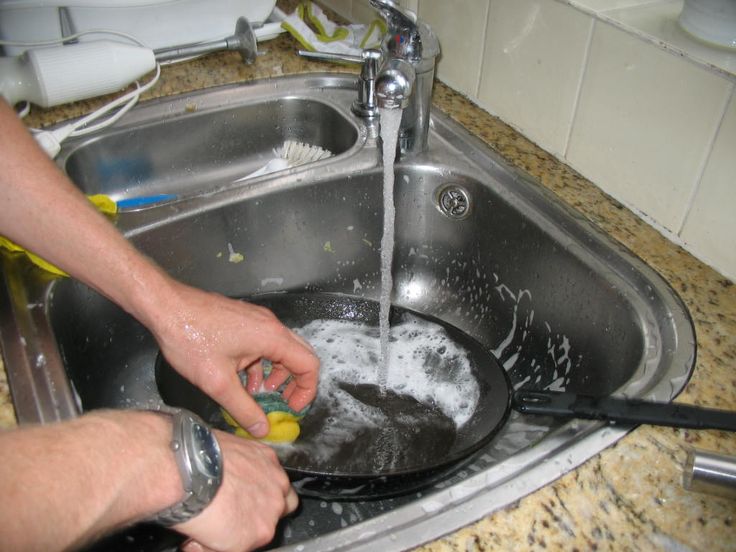
The height and width of the screenshot is (552, 736). What are the coordinates of `overflow drain` in the screenshot? It's located at (502, 261), (452, 197).